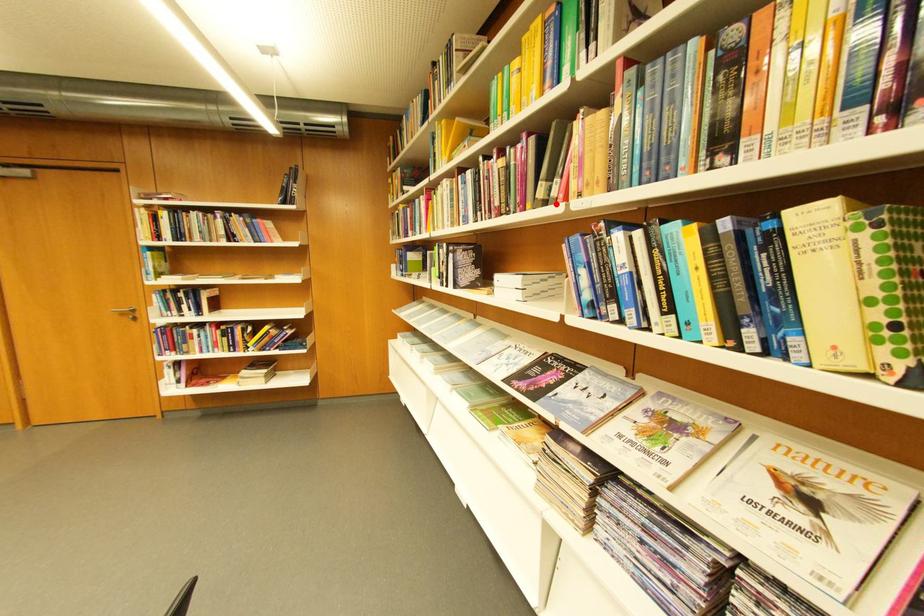
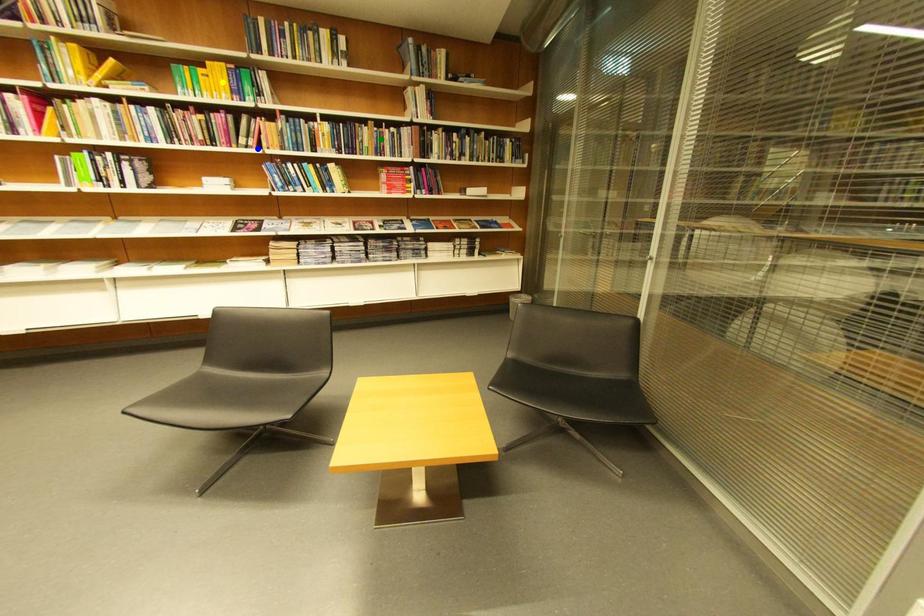
Question: I am providing you with two images of the same scene from different viewpoints. A red point is marked on the first image. You are given multiple points on the second image. Which point in image 2 represents the same 3d spot as the red point in image 1?

Choices:
 (A) yellow point
 (B) green point
 (C) blue point

Answer: (C)